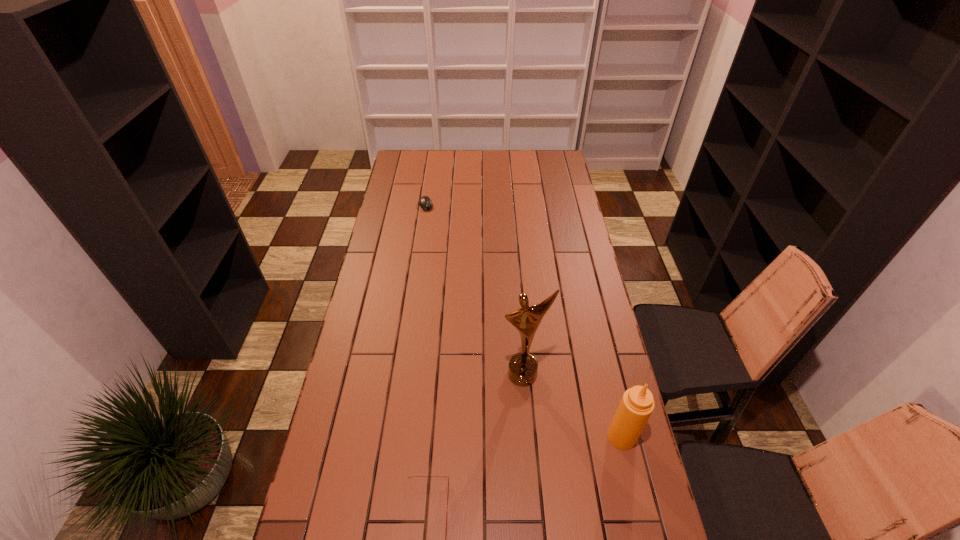
Locate an element on the screen. This screenshot has width=960, height=540. vacant space on the desktop that is between the sunglasses and the condiment and is positioned on the front-facing side of the second farthest object is located at coordinates (542, 467).

Identify the location of vacant spot on the desktop that is between the sunglasses and the rightmost object and is positioned on the wheel side of the computer mouse. (536, 469).